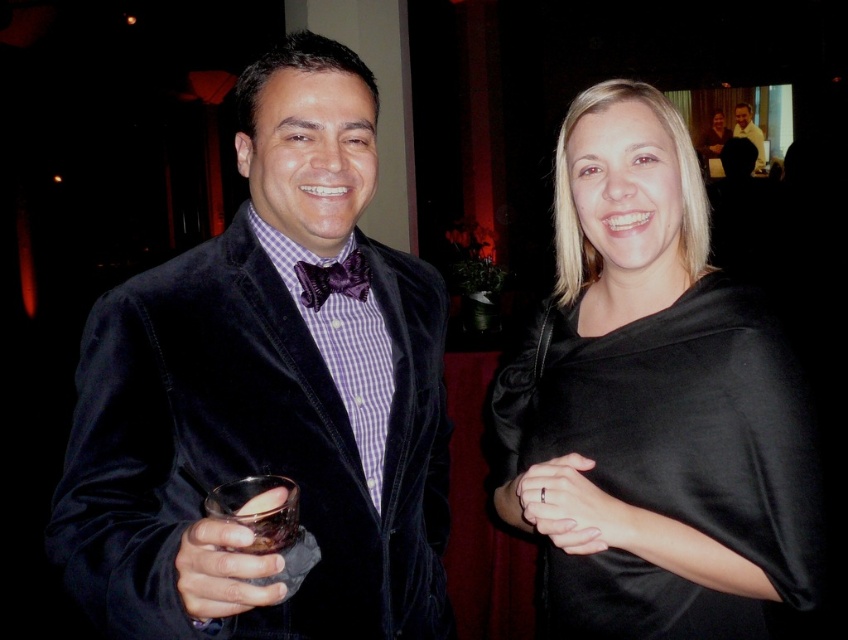
Is point (283, 176) closer to camera compared to point (522, 481)?

That is False.

Which is in front, point (215, 385) or point (526, 474)?

Point (526, 474) is in front.

Find the location of `velvet black jacket at left`. velvet black jacket at left is located at coordinates (269, 388).

Identify the location of velvet black jacket at left. (269, 388).

Is black satin dress at center closer to the viewer compared to purple velvet bow tie at center?

Yes.

Is point (726, 458) farther from camera compared to point (358, 289)?

No, (726, 458) is in front of (358, 289).

In order to click on black satin dress at center in this screenshot , I will do `click(651, 403)`.

Which is behind, point (674, 192) or point (760, 172)?

The point (760, 172) is more distant.

Can you confirm if black satin dress at center is shorter than matte black bow tie at upper right?

Indeed, black satin dress at center has a lesser height compared to matte black bow tie at upper right.

Describe the element at coordinates (651, 403) in the screenshot. The height and width of the screenshot is (640, 848). I see `black satin dress at center` at that location.

At what (x,y) coordinates should I click in order to perform the action: click on black satin dress at center. Please return your answer as a coordinate pair (x, y). The height and width of the screenshot is (640, 848). Looking at the image, I should click on (651, 403).